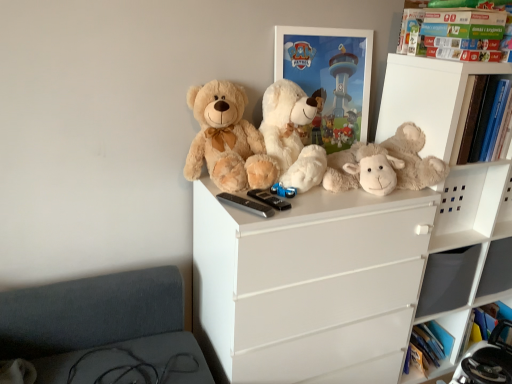
Question: Can fluffy white teddy bear at upper center, the 2th teddy bear positioned from the right, be found inside white glossy picture frame at upper center?

Choices:
 (A) yes
 (B) no

Answer: (B)

Question: Can you confirm if white glossy picture frame at upper center is thinner than fluffy white teddy bear at upper center, which is the second teddy bear in left-to-right order?

Choices:
 (A) no
 (B) yes

Answer: (B)

Question: Does white glossy picture frame at upper center have a smaller size compared to fluffy white teddy bear at upper center, the 2th teddy bear positioned from the right?

Choices:
 (A) no
 (B) yes

Answer: (B)

Question: Is white glossy picture frame at upper center closer to the viewer compared to fluffy white teddy bear at upper center, the 2th teddy bear positioned from the right?

Choices:
 (A) yes
 (B) no

Answer: (B)

Question: Is white glossy picture frame at upper center looking in the opposite direction of fluffy white teddy bear at upper center, which is the second teddy bear in left-to-right order?

Choices:
 (A) yes
 (B) no

Answer: (B)

Question: From the image's perspective, relative to fluffy beige teddy bear at upper center, the 3th teddy bear from the right, is white glossy picture frame at upper center above or below?

Choices:
 (A) above
 (B) below

Answer: (A)

Question: From a real-world perspective, is white glossy picture frame at upper center physically located above or below fluffy beige teddy bear at upper center, which appears as the first teddy bear when viewed from the left?

Choices:
 (A) below
 (B) above

Answer: (B)

Question: Considering the positions of point (330, 91) and point (245, 183), is point (330, 91) closer or farther from the camera than point (245, 183)?

Choices:
 (A) closer
 (B) farther

Answer: (B)

Question: Considering the positions of white glossy picture frame at upper center and fluffy beige teddy bear at upper center, the 3th teddy bear from the right, in the image, is white glossy picture frame at upper center bigger or smaller than fluffy beige teddy bear at upper center, the 3th teddy bear from the right,?

Choices:
 (A) small
 (B) big

Answer: (A)

Question: Is green cardboard book at upper right to the left or to the right of fluffy white teddy bear at upper center, which is the second teddy bear in left-to-right order, in the image?

Choices:
 (A) left
 (B) right

Answer: (B)

Question: Looking at their shapes, would you say green cardboard book at upper right is wider or thinner than fluffy white teddy bear at upper center, which is the second teddy bear in left-to-right order?

Choices:
 (A) wide
 (B) thin

Answer: (B)

Question: From a real-world perspective, is green cardboard book at upper right positioned above or below fluffy white teddy bear at upper center, which is the second teddy bear in left-to-right order?

Choices:
 (A) below
 (B) above

Answer: (B)

Question: In the image, is green cardboard book at upper right positioned in front of or behind fluffy white teddy bear at upper center, the 2th teddy bear positioned from the right?

Choices:
 (A) behind
 (B) front

Answer: (A)

Question: Is green cardboard book at upper right to the left or to the right of white glossy picture frame at upper center in the image?

Choices:
 (A) left
 (B) right

Answer: (B)

Question: From the image's perspective, relative to white glossy picture frame at upper center, is green cardboard book at upper right above or below?

Choices:
 (A) above
 (B) below

Answer: (A)